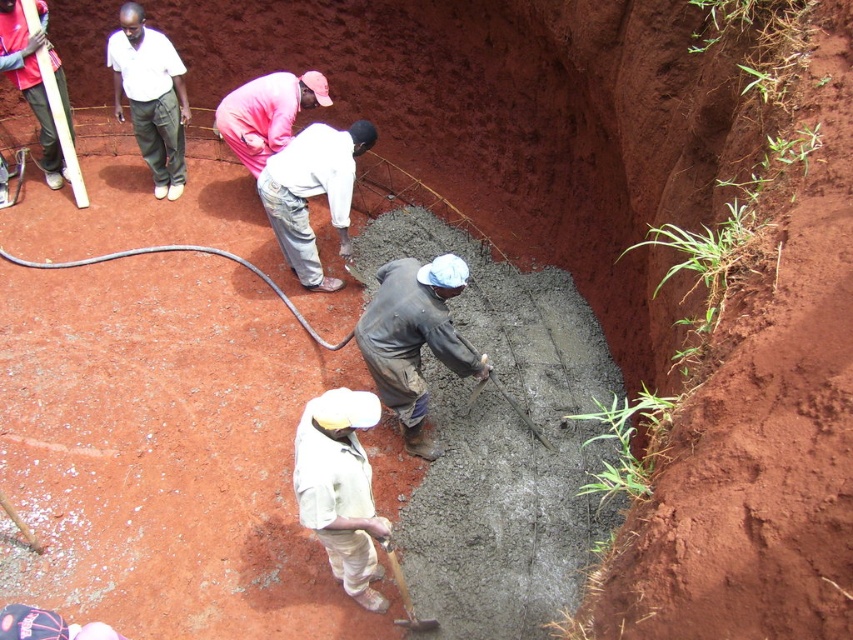
Can you confirm if dark gray uniform at center is positioned above wooden handle shovel at lower center?

Indeed, dark gray uniform at center is positioned over wooden handle shovel at lower center.

Describe the element at coordinates (413, 339) in the screenshot. The width and height of the screenshot is (853, 640). I see `dark gray uniform at center` at that location.

What are the coordinates of `dark gray uniform at center` in the screenshot? It's located at (413, 339).

Is white matte shirt at center positioned behind pink matte shirt at center?

No, it is not.

Who is more distant from viewer, (347, 504) or (306, 77)?

Point (306, 77)

What are the coordinates of `white matte shirt at center` in the screenshot? It's located at (340, 488).

Is dark gray uniform at center above pink matte shirt at center?

No.

Can you confirm if dark gray uniform at center is wider than pink matte shirt at center?

No.

Locate an element on the screen. The width and height of the screenshot is (853, 640). dark gray uniform at center is located at coordinates (413, 339).